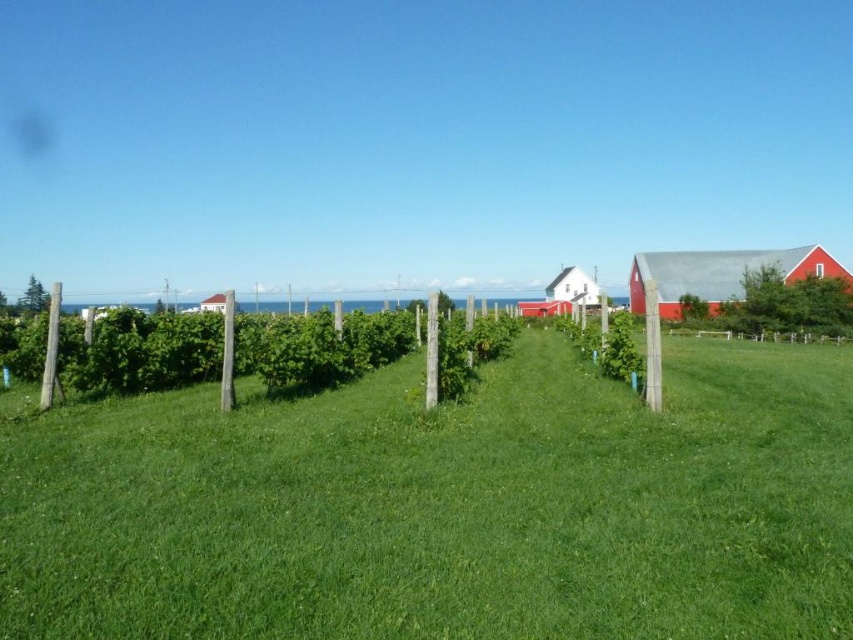
Question: Based on their relative distances, which object is farther from the green leafy hedge at center?

Choices:
 (A) white matte barn at center
 (B) red matte barn at right

Answer: (A)

Question: Which is nearer to the white matte barn at center?

Choices:
 (A) green grassy at center
 (B) red matte barn at right

Answer: (B)

Question: Which point is closer to the camera?

Choices:
 (A) white matte barn at center
 (B) green leafy hedge at center

Answer: (B)

Question: Does green grassy at center appear on the right side of red matte barn at right?

Choices:
 (A) yes
 (B) no

Answer: (B)

Question: Is green leafy hedge at center positioned at the back of red matte barn at right?

Choices:
 (A) no
 (B) yes

Answer: (B)

Question: Is green grassy at center below white matte barn at center?

Choices:
 (A) yes
 (B) no

Answer: (A)